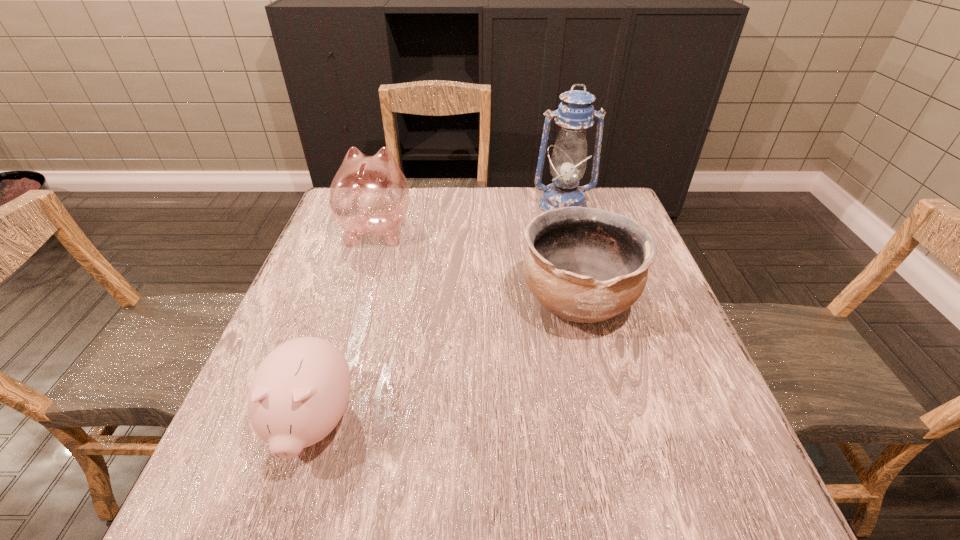
At what (x,y) coordinates should I click in order to perform the action: click on lantern. Please return your answer as a coordinate pair (x, y). This screenshot has height=540, width=960. Looking at the image, I should click on (575, 113).

In order to click on the second tallest object in this screenshot , I will do `click(369, 196)`.

Where is `the taller piggy bank`? Image resolution: width=960 pixels, height=540 pixels. the taller piggy bank is located at coordinates (369, 196).

Where is `the third farthest object`? the third farthest object is located at coordinates (587, 265).

The image size is (960, 540). In order to click on the nearer piggy bank in this screenshot , I will do `click(298, 394)`.

Where is `the nearest object`? The height and width of the screenshot is (540, 960). the nearest object is located at coordinates (298, 394).

I want to click on free location located on the front-facing side of the lantern, so click(x=588, y=297).

You are a GUI agent. You are given a task and a screenshot of the screen. Output one action in this format:
    pyautogui.click(x=<x>, y=<y>)
    Task: Click on the free space located 0.070m on the front facing side of the farther piggy bank
    
    Given the screenshot: What is the action you would take?
    pyautogui.click(x=388, y=193)

Find the location of a particular element. The height and width of the screenshot is (540, 960). free space located 0.090m on the front facing side of the farther piggy bank is located at coordinates (389, 190).

You are a GUI agent. You are given a task and a screenshot of the screen. Output one action in this format:
    pyautogui.click(x=<x>, y=<y>)
    Task: Click on the vacant space located 0.070m on the front facing side of the farther piggy bank
    
    Given the screenshot: What is the action you would take?
    pyautogui.click(x=388, y=193)